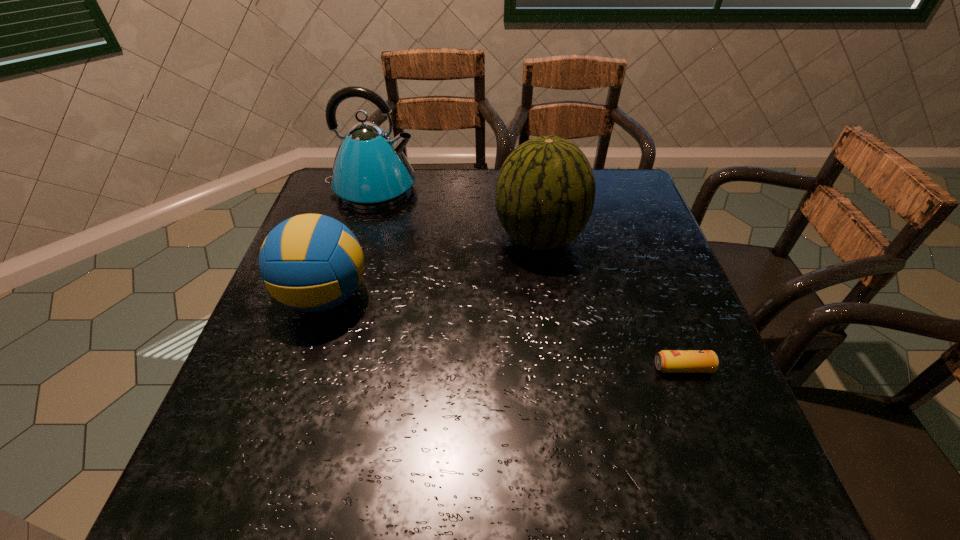
Image resolution: width=960 pixels, height=540 pixels. Find the location of `kettle`. kettle is located at coordinates (370, 171).

Identify the location of watermelon. (545, 192).

Locate an element on the screen. The width and height of the screenshot is (960, 540). the second shortest object is located at coordinates click(x=310, y=262).

Locate an element on the screen. the rightmost object is located at coordinates (668, 361).

In order to click on the shortest object in this screenshot , I will do `click(668, 361)`.

Locate an element on the screen. The height and width of the screenshot is (540, 960). free region located at the spout of the kettle is located at coordinates tap(494, 189).

Locate an element on the screen. The width and height of the screenshot is (960, 540). free space located 0.150m on the back of the second object from right to left is located at coordinates (531, 181).

Locate an element on the screen. Image resolution: width=960 pixels, height=540 pixels. vacant region located on the back of the second shortest object is located at coordinates (349, 222).

Find the location of a particular element. The width and height of the screenshot is (960, 540). free region located 0.210m on the front of the rightmost object is located at coordinates (730, 490).

Image resolution: width=960 pixels, height=540 pixels. Find the location of `kettle located at the far edge`. kettle located at the far edge is located at coordinates (370, 171).